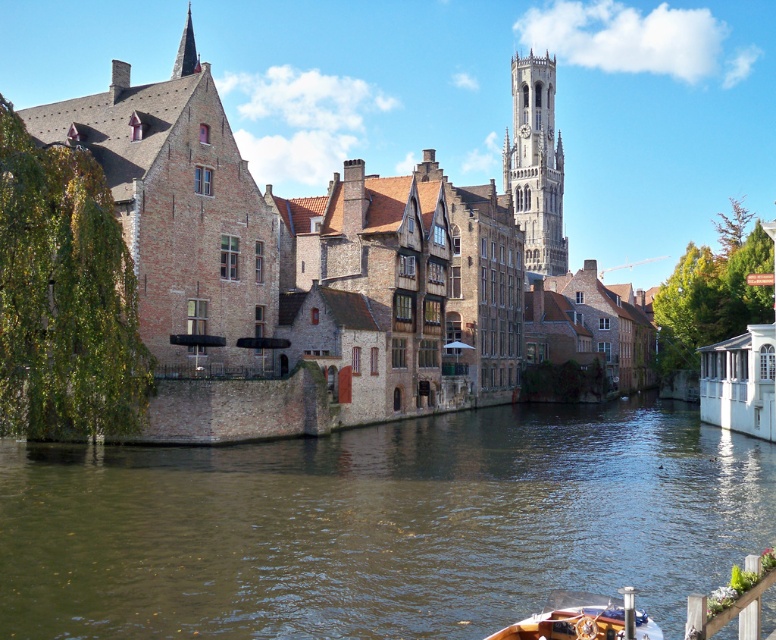
Who is positioned more to the left, stone clock tower at upper right or wooden polished boat at lower center?

Positioned to the left is wooden polished boat at lower center.

Is stone clock tower at upper right thinner than wooden polished boat at lower center?

No.

Which is in front, point (513, 164) or point (549, 621)?

Point (549, 621) is more forward.

This screenshot has height=640, width=776. I want to click on stone clock tower at upper right, so click(535, 164).

Who is shorter, brown water at center or wooden polished boat at lower center?

Standing shorter between the two is wooden polished boat at lower center.

Can you confirm if brown water at center is positioned above wooden polished boat at lower center?

Correct, brown water at center is located above wooden polished boat at lower center.

Who is more forward, (x=380, y=529) or (x=494, y=637)?

Point (x=494, y=637) is more forward.

You are a GUI agent. You are given a task and a screenshot of the screen. Output one action in this format:
    pyautogui.click(x=<x>, y=<y>)
    Task: Click on the brown water at center
    This screenshot has height=640, width=776.
    Given the screenshot: What is the action you would take?
    pyautogui.click(x=380, y=524)

Does brown water at center appear under stone clock tower at upper right?

Indeed, brown water at center is positioned under stone clock tower at upper right.

Does brown water at center come behind stone clock tower at upper right?

No, it is not.

Which is behind, point (712, 579) or point (544, 141)?

Point (544, 141)

Locate an element on the screen. brown water at center is located at coordinates (380, 524).